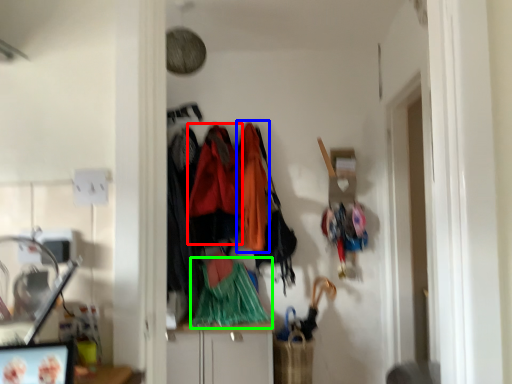
Question: Which object is positioned closest to clothing (highlighted by a red box)? Select from clothing (highlighted by a blue box) and clothing (highlighted by a green box).

Choices:
 (A) clothing
 (B) clothing

Answer: (A)